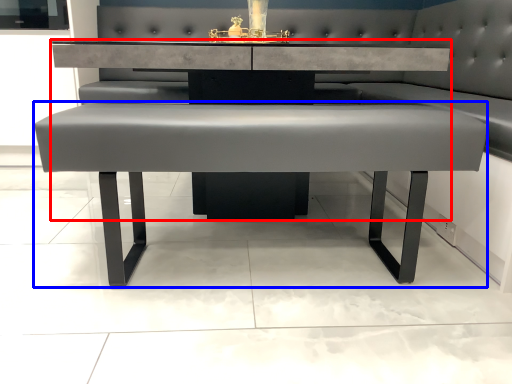
Question: Which of the following is the farthest to the observer, table (highlighted by a red box) or table (highlighted by a blue box)?

Choices:
 (A) table
 (B) table

Answer: (A)